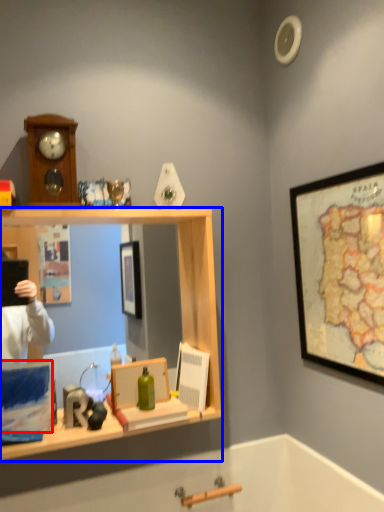
Question: Which object appears farthest to the camera in this image, box (highlighted by a red box) or desk (highlighted by a blue box)?

Choices:
 (A) box
 (B) desk

Answer: (A)